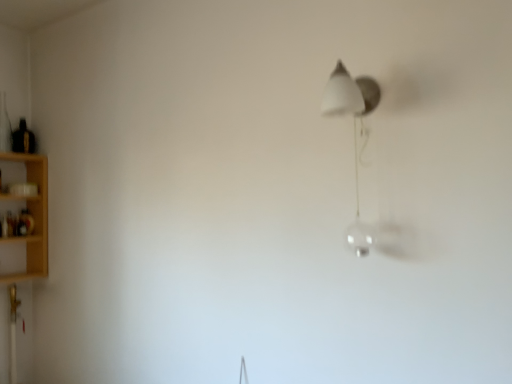
Describe the element at coordinates (354, 133) in the screenshot. I see `satin white lamp at upper right` at that location.

What is the approximate height of satin white lamp at upper right?

The height of satin white lamp at upper right is 20.12 inches.

Measure the distance between point (330, 110) and camera.

Point (330, 110) and camera are 1.15 meters apart.

The image size is (512, 384). I want to click on satin white lamp at upper right, so click(x=354, y=133).

At what (x,y) coordinates should I click in order to perform the action: click on satin white lamp at upper right. Please return your answer as a coordinate pair (x, y). Looking at the image, I should click on (354, 133).